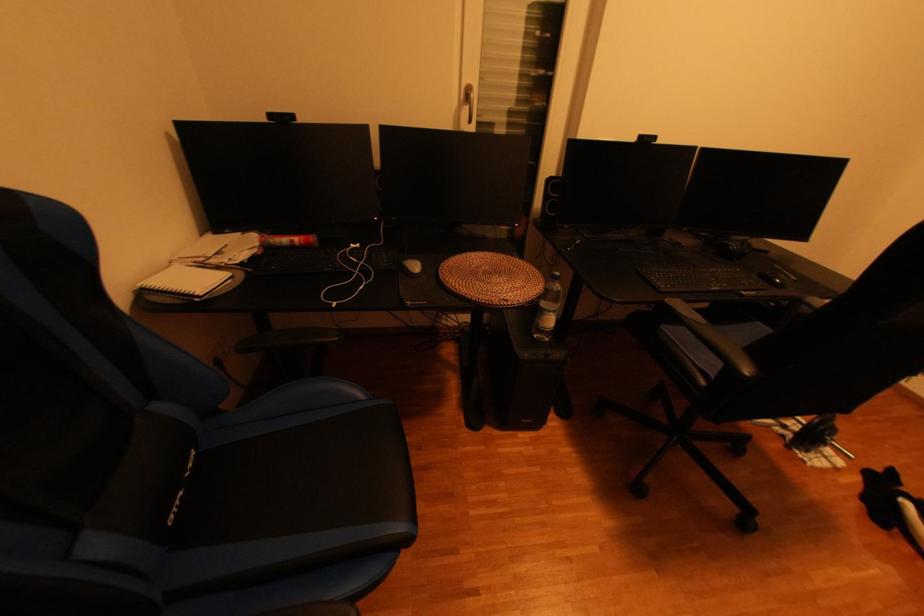
Where is `black chair armrest`? black chair armrest is located at coordinates (713, 339).